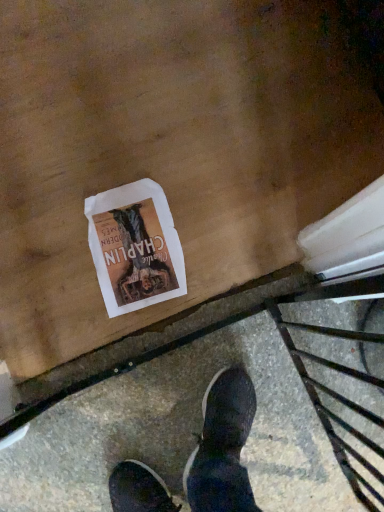
Where is `vacant space underneath white paper flyer at center (from a real-world perspective)`? The height and width of the screenshot is (512, 384). vacant space underneath white paper flyer at center (from a real-world perspective) is located at coordinates (135, 249).